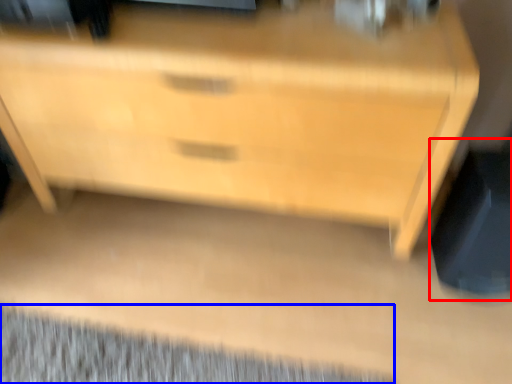
Question: Which of the following is the closest to the observer, swivel chair (highlighted by a red box) or mat (highlighted by a blue box)?

Choices:
 (A) swivel chair
 (B) mat

Answer: (A)